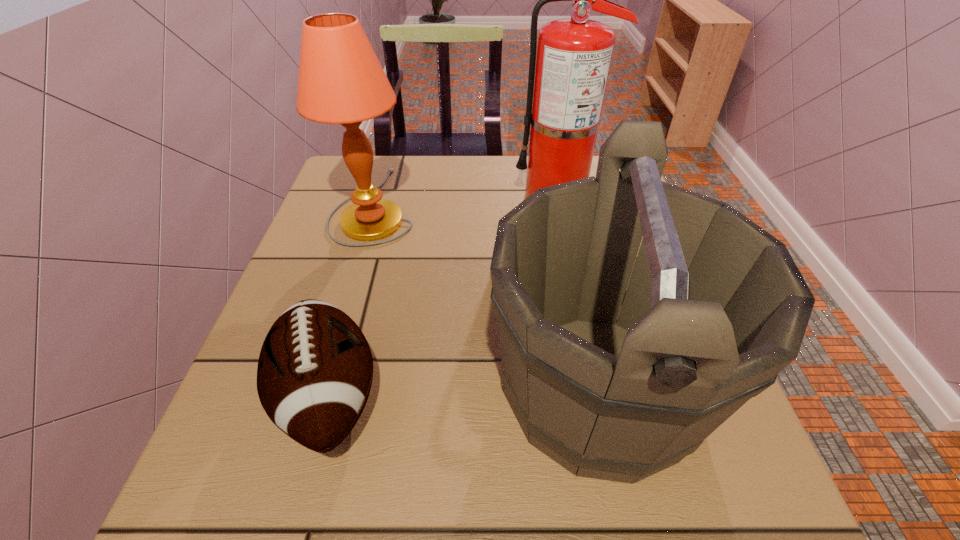
I want to click on vacant area that lies between the fire extinguisher and the lamp, so click(466, 201).

Locate which object ranks third in proximity to the shortest object. Please provide its 2D coordinates. Your answer should be formatted as a tuple, i.e. [(x, y)], where the tuple contains the x and y coordinates of a point satisfying the conditions above.

[(573, 60)]

Select which object appears as the third closest to the shortest object. Please provide its 2D coordinates. Your answer should be formatted as a tuple, i.e. [(x, y)], where the tuple contains the x and y coordinates of a point satisfying the conditions above.

[(573, 60)]

At what (x,y) coordinates should I click in order to perform the action: click on vacant space that satisfies the following two spatial constraints: 1. at the nozzle of the fire extinguisher; 2. on the right side of the bucket. Please return your answer as a coordinate pair (x, y). Looking at the image, I should click on (598, 389).

Identify the location of blank area in the image that satisfies the following two spatial constraints: 1. at the nozzle of the fire extinguisher; 2. on the front side of the lamp. (558, 205).

This screenshot has height=540, width=960. Identify the location of free spot that satisfies the following two spatial constraints: 1. at the nozzle of the bucket; 2. on the right side of the fire extinguisher. click(598, 389).

Locate an element on the screen. This screenshot has width=960, height=540. free location that satisfies the following two spatial constraints: 1. at the nozzle of the fire extinguisher; 2. on the left side of the bucket is located at coordinates (598, 389).

Image resolution: width=960 pixels, height=540 pixels. Find the location of `free point that satisfies the following two spatial constraints: 1. at the nozzle of the fire extinguisher; 2. on the left side of the bucket`. free point that satisfies the following two spatial constraints: 1. at the nozzle of the fire extinguisher; 2. on the left side of the bucket is located at coordinates (598, 389).

Find the location of a particular element. This screenshot has height=540, width=960. vacant area that satisfies the following two spatial constraints: 1. at the nozzle of the fire extinguisher; 2. on the left side of the bucket is located at coordinates (598, 389).